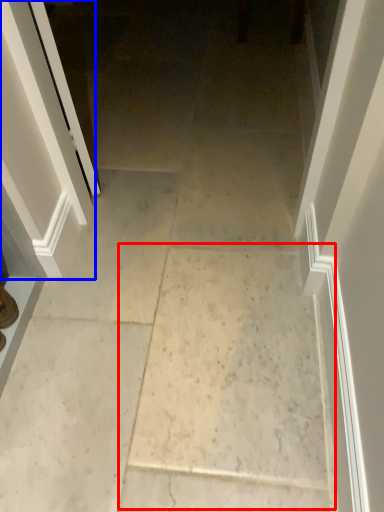
Question: Among these objects, which one is farthest to the camera, concrete (highlighted by a red box) or screen door (highlighted by a blue box)?

Choices:
 (A) concrete
 (B) screen door

Answer: (B)